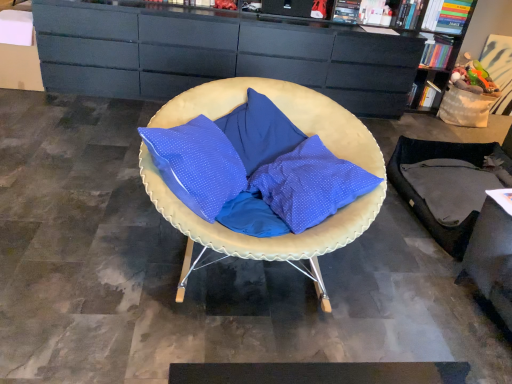
Question: Is matte black cabinet at upper center further to the viewer compared to matte blue cushion at center?

Choices:
 (A) no
 (B) yes

Answer: (B)

Question: Would you say matte black cabinet at upper center is a long distance from matte blue cushion at center?

Choices:
 (A) no
 (B) yes

Answer: (B)

Question: Considering the relative sizes of matte black cabinet at upper center and matte blue cushion at center in the image provided, is matte black cabinet at upper center wider than matte blue cushion at center?

Choices:
 (A) no
 (B) yes

Answer: (A)

Question: Can you confirm if matte black cabinet at upper center is bigger than matte blue cushion at center?

Choices:
 (A) yes
 (B) no

Answer: (A)

Question: From a real-world perspective, is matte black cabinet at upper center under matte blue cushion at center?

Choices:
 (A) yes
 (B) no

Answer: (B)

Question: Is matte black cabinet at upper center taller than matte blue cushion at center?

Choices:
 (A) no
 (B) yes

Answer: (B)

Question: Considering the relative sizes of matte blue cushion at center and matte black cabinet at upper center in the image provided, is matte blue cushion at center taller than matte black cabinet at upper center?

Choices:
 (A) no
 (B) yes

Answer: (A)

Question: Is matte blue cushion at center further to camera compared to matte black cabinet at upper center?

Choices:
 (A) no
 (B) yes

Answer: (A)

Question: From the image's perspective, does matte blue cushion at center appear lower than matte black cabinet at upper center?

Choices:
 (A) no
 (B) yes

Answer: (B)

Question: Are matte blue cushion at center and matte black cabinet at upper center far apart?

Choices:
 (A) yes
 (B) no

Answer: (A)

Question: Does matte blue cushion at center have a larger size compared to matte black cabinet at upper center?

Choices:
 (A) yes
 (B) no

Answer: (B)

Question: Does matte blue cushion at center appear on the left side of matte black cabinet at upper center?

Choices:
 (A) yes
 (B) no

Answer: (A)

Question: In the image, is matte blue cushion at center on the left side or the right side of matte black cabinet at upper center?

Choices:
 (A) right
 (B) left

Answer: (B)